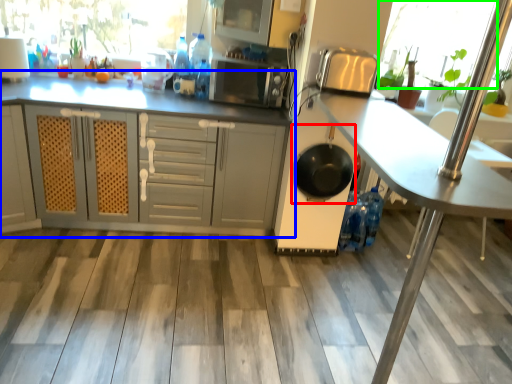
Question: Considering the real-world distances, which object is farthest from frying pan (highlighted by a red box)? cabinetry (highlighted by a blue box) or window screen (highlighted by a green box)?

Choices:
 (A) cabinetry
 (B) window screen

Answer: (B)